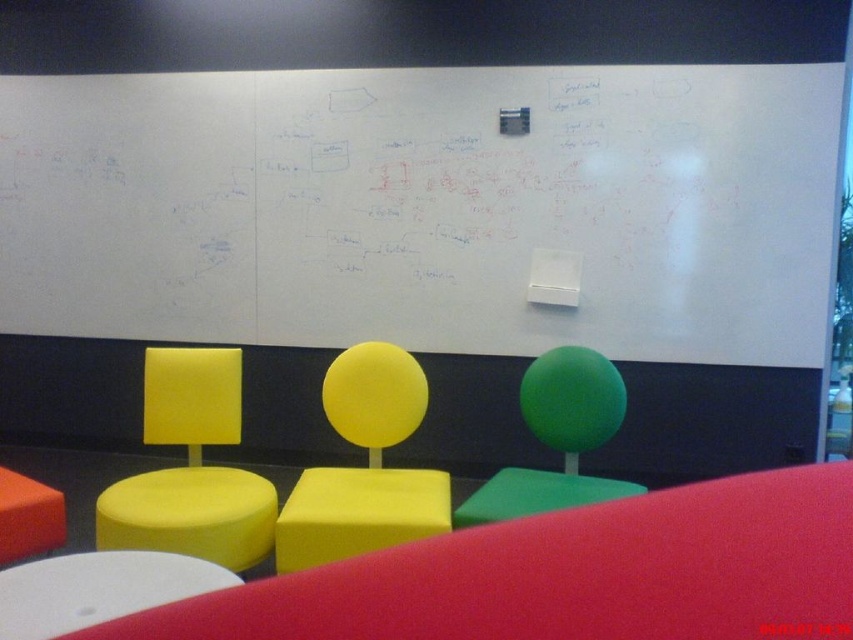
Question: Can you confirm if whiteboard at upper center is thinner than matte yellow chair at left?

Choices:
 (A) no
 (B) yes

Answer: (A)

Question: Can you confirm if matte yellow chair at left is smaller than yellow matte chair at center?

Choices:
 (A) no
 (B) yes

Answer: (B)

Question: Which of these objects is positioned closest to the matte yellow chair at left?

Choices:
 (A) white matte stool at lower left
 (B) green foam chair at right

Answer: (A)

Question: Estimate the real-world distances between objects in this image. Which object is farther from the matte yellow chair at left?

Choices:
 (A) green foam chair at right
 (B) matte orange stool at lower left
 (C) whiteboard at upper center

Answer: (C)

Question: Which is farther from the white matte stool at lower left?

Choices:
 (A) whiteboard at upper center
 (B) yellow matte chair at center

Answer: (A)

Question: Does green foam chair at right have a greater width compared to white matte stool at lower left?

Choices:
 (A) yes
 (B) no

Answer: (A)